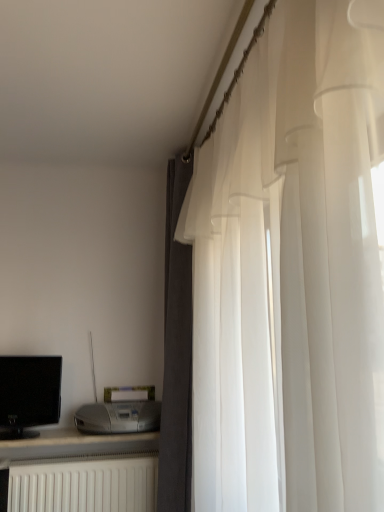
Question: Can you see black glossy computer monitor at left touching dark gray fabric curtain at right, the second curtain when ordered from front to back?

Choices:
 (A) no
 (B) yes

Answer: (A)

Question: From the image's perspective, would you say black glossy computer monitor at left is shown under dark gray fabric curtain at right, the second curtain when ordered from front to back?

Choices:
 (A) yes
 (B) no

Answer: (A)

Question: Is black glossy computer monitor at left positioned behind dark gray fabric curtain at right, the second curtain when ordered from front to back?

Choices:
 (A) yes
 (B) no

Answer: (A)

Question: Is black glossy computer monitor at left not inside dark gray fabric curtain at right, the second curtain when ordered from front to back?

Choices:
 (A) no
 (B) yes

Answer: (B)

Question: Is black glossy computer monitor at left positioned far away from dark gray fabric curtain at right, which is counted as the 1th curtain, starting from the back?

Choices:
 (A) yes
 (B) no

Answer: (B)

Question: Is satin silver printer at lower left situated inside white sheer curtain at right, arranged as the second curtain when viewed from the back, or outside?

Choices:
 (A) inside
 (B) outside

Answer: (B)

Question: Based on their sizes in the image, would you say satin silver printer at lower left is bigger or smaller than white sheer curtain at right, arranged as the second curtain when viewed from the back?

Choices:
 (A) small
 (B) big

Answer: (A)

Question: From a real-world perspective, relative to white sheer curtain at right, arranged as the second curtain when viewed from the back, is satin silver printer at lower left vertically above or below?

Choices:
 (A) below
 (B) above

Answer: (A)

Question: Visually, is satin silver printer at lower left positioned to the left or to the right of white sheer curtain at right, the 1th curtain in the front-to-back sequence?

Choices:
 (A) right
 (B) left

Answer: (B)

Question: Considering the positions of point (33, 473) and point (380, 34), is point (33, 473) closer or farther from the camera than point (380, 34)?

Choices:
 (A) closer
 (B) farther

Answer: (B)

Question: Would you say white matte radiator at lower left is inside or outside white sheer curtain at right, the 1th curtain in the front-to-back sequence?

Choices:
 (A) outside
 (B) inside

Answer: (A)

Question: In terms of height, does white matte radiator at lower left look taller or shorter compared to white sheer curtain at right, the 1th curtain in the front-to-back sequence?

Choices:
 (A) tall
 (B) short

Answer: (B)

Question: From a real-world perspective, is white matte radiator at lower left physically located above or below white sheer curtain at right, arranged as the second curtain when viewed from the back?

Choices:
 (A) below
 (B) above

Answer: (A)

Question: Considering their positions, is black glossy computer monitor at left located in front of or behind satin silver printer at lower left?

Choices:
 (A) front
 (B) behind

Answer: (B)

Question: Considering the positions of black glossy computer monitor at left and satin silver printer at lower left in the image, is black glossy computer monitor at left wider or thinner than satin silver printer at lower left?

Choices:
 (A) thin
 (B) wide

Answer: (A)